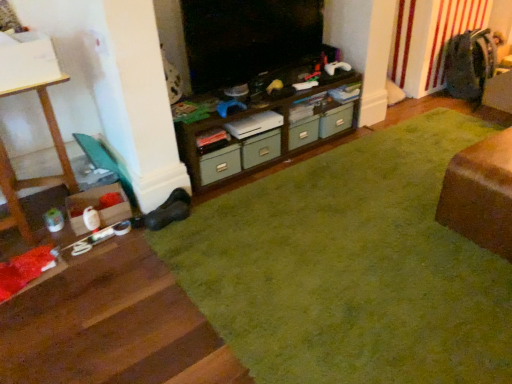
Identify the location of vacant area that is situated to the right of green matte drawer at center, which is the 2th drawer in front-to-back order. The image size is (512, 384). (366, 136).